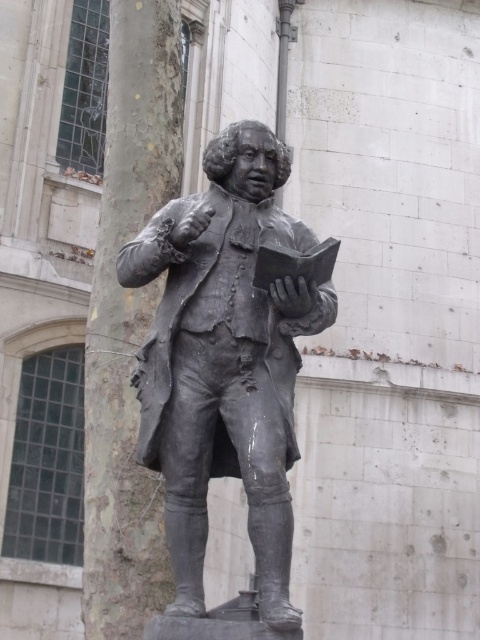
Between bronze statue at center and smooth bark tree trunk at left, which one has less height?

Standing shorter between the two is bronze statue at center.

Is bronze statue at center shorter than smooth bark tree trunk at left?

Indeed, bronze statue at center has a lesser height compared to smooth bark tree trunk at left.

Identify the location of bronze statue at center. This screenshot has width=480, height=640. (225, 360).

Where is `bronze statue at center`? The height and width of the screenshot is (640, 480). bronze statue at center is located at coordinates (225, 360).